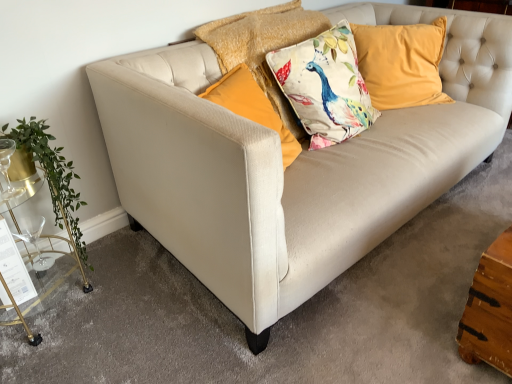
I want to click on green leafy plant at left, so click(53, 176).

Where is `velvet yellow pillow at upper right, acting as the first pillow starting from the right`? This screenshot has height=384, width=512. velvet yellow pillow at upper right, acting as the first pillow starting from the right is located at coordinates (401, 63).

You are a GUI agent. You are given a task and a screenshot of the screen. Output one action in this format:
    pyautogui.click(x=<x>, y=<y>)
    Task: Click on the gold metallic bar cart at left
    This screenshot has height=384, width=512.
    Given the screenshot: What is the action you would take?
    pyautogui.click(x=18, y=316)

Does green leafy plant at left turn towards gold metallic bar cart at left?

Yes, green leafy plant at left is oriented towards gold metallic bar cart at left.

Can you confirm if green leafy plant at left is positioned to the right of gold metallic bar cart at left?

Yes.

Is green leafy plant at left beside gold metallic bar cart at left?

No, green leafy plant at left is not with gold metallic bar cart at left.

Measure the distance between clear glass wine glass at lower left and velvet yellow pillow at upper right, the second pillow when ordered from left to right.

clear glass wine glass at lower left and velvet yellow pillow at upper right, the second pillow when ordered from left to right, are 6.13 feet apart.

How different are the orientations of clear glass wine glass at lower left and velvet yellow pillow at upper right, the second pillow when ordered from left to right, in degrees?

They differ by 39.6 degrees in their facing directions.

Is clear glass wine glass at lower left positioned behind velvet yellow pillow at upper right, the second pillow when ordered from left to right?

No, it is in front of velvet yellow pillow at upper right, the second pillow when ordered from left to right.

Is clear glass wine glass at lower left directly adjacent to velvet yellow pillow at upper right, the second pillow when ordered from left to right?

No, clear glass wine glass at lower left is not next to velvet yellow pillow at upper right, the second pillow when ordered from left to right.

Is the surface of green leafy plant at left in direct contact with velvet yellow pillow at upper right, acting as the first pillow starting from the right?

No, green leafy plant at left is not with velvet yellow pillow at upper right, acting as the first pillow starting from the right.

Considering the relative positions of green leafy plant at left and velvet yellow pillow at upper right, acting as the first pillow starting from the right, in the image provided, is green leafy plant at left to the left of velvet yellow pillow at upper right, acting as the first pillow starting from the right, from the viewer's perspective?

Yes, green leafy plant at left is to the left of velvet yellow pillow at upper right, acting as the first pillow starting from the right.

Does point (61, 199) come farther from viewer compared to point (385, 98)?

No, (61, 199) is closer to viewer.

From the image's perspective, which one is positioned lower, velvet yellow pillow at upper right, the second pillow when ordered from left to right, or gold metallic bar cart at left?

gold metallic bar cart at left is shown below in the image.

From a real-world perspective, relative to gold metallic bar cart at left, is velvet yellow pillow at upper right, acting as the first pillow starting from the right, vertically above or below?

Clearly, from a real-world perspective, velvet yellow pillow at upper right, acting as the first pillow starting from the right, is above gold metallic bar cart at left.

Is velvet yellow pillow at upper right, the second pillow when ordered from left to right, positioned with its back to gold metallic bar cart at left?

No, velvet yellow pillow at upper right, the second pillow when ordered from left to right,'s orientation is not away from gold metallic bar cart at left.

Which object is thinner, velvet yellow pillow at upper right, the second pillow when ordered from left to right, or gold metallic bar cart at left?

velvet yellow pillow at upper right, the second pillow when ordered from left to right.

Is green leafy plant at left not close to floral fabric cushion at center, arranged as the second pillow when viewed from the right?

No, green leafy plant at left is not far away from floral fabric cushion at center, arranged as the second pillow when viewed from the right.

Identify the location of plant below the floral fabric cushion at center, arranged as the second pillow when viewed from the right (from a real-world perspective). (53, 176).

Is green leafy plant at left shorter than floral fabric cushion at center, acting as the 1th pillow starting from the left?

No.

From the image's perspective, which one is positioned lower, green leafy plant at left or floral fabric cushion at center, acting as the 1th pillow starting from the left?

green leafy plant at left appears lower in the image.

In the scene shown: From the image's perspective, between gold metallic bar cart at left and velvet yellow pillow at upper right, acting as the first pillow starting from the right, who is located below?

gold metallic bar cart at left, from the image's perspective.

Which is behind, point (6, 180) or point (400, 56)?

The point (400, 56) is farther from the camera.

Considering the sizes of objects gold metallic bar cart at left and velvet yellow pillow at upper right, the second pillow when ordered from left to right, in the image provided, who is wider, gold metallic bar cart at left or velvet yellow pillow at upper right, the second pillow when ordered from left to right,?

gold metallic bar cart at left is wider.

From a real-world perspective, is gold metallic bar cart at left positioned above or below velvet yellow pillow at upper right, acting as the first pillow starting from the right?

gold metallic bar cart at left is below velvet yellow pillow at upper right, acting as the first pillow starting from the right.

Is point (267, 69) closer to viewer compared to point (24, 220)?

That is False.

Looking at this image, is clear glass wine glass at lower left inside floral fabric cushion at center, acting as the 1th pillow starting from the left?

Actually, clear glass wine glass at lower left is outside floral fabric cushion at center, acting as the 1th pillow starting from the left.

From a real-world perspective, relative to clear glass wine glass at lower left, is floral fabric cushion at center, arranged as the second pillow when viewed from the right, vertically above or below?

From a real-world perspective, floral fabric cushion at center, arranged as the second pillow when viewed from the right, is physically above clear glass wine glass at lower left.

What's the angular difference between floral fabric cushion at center, acting as the 1th pillow starting from the left, and clear glass wine glass at lower left's facing directions?

The angular difference between floral fabric cushion at center, acting as the 1th pillow starting from the left, and clear glass wine glass at lower left is 0.141 degrees.

In order to click on plant behind the gold metallic bar cart at left in this screenshot , I will do `click(53, 176)`.

From the image's perspective, count 2nd pillows upward from the clear glass wine glass at lower left and point to it. Please provide its 2D coordinates.

[(401, 63)]

Considering their positions, is clear glass wine glass at lower left positioned further to floral fabric cushion at center, acting as the 1th pillow starting from the left, than gold metallic bar cart at left?

Based on the image, clear glass wine glass at lower left appears to be further to floral fabric cushion at center, acting as the 1th pillow starting from the left.

Estimate the real-world distances between objects in this image. Which object is closer to velvet yellow pillow at upper right, acting as the first pillow starting from the right, floral fabric cushion at center, arranged as the second pillow when viewed from the right, or green leafy plant at left?

Based on the image, floral fabric cushion at center, arranged as the second pillow when viewed from the right, appears to be nearer to velvet yellow pillow at upper right, acting as the first pillow starting from the right.

Based on their spatial positions, is gold metallic bar cart at left or velvet yellow pillow at upper right, acting as the first pillow starting from the right, further from clear glass wine glass at lower left?

Based on the image, velvet yellow pillow at upper right, acting as the first pillow starting from the right, appears to be further to clear glass wine glass at lower left.

From the image, which object appears to be nearer to velvet yellow pillow at upper right, the second pillow when ordered from left to right, gold metallic bar cart at left or floral fabric cushion at center, acting as the 1th pillow starting from the left?

Based on the image, floral fabric cushion at center, acting as the 1th pillow starting from the left, appears to be nearer to velvet yellow pillow at upper right, the second pillow when ordered from left to right.

Which object lies nearer to the anchor point velvet yellow pillow at upper right, acting as the first pillow starting from the right, green leafy plant at left or gold metallic bar cart at left?

The object closer to velvet yellow pillow at upper right, acting as the first pillow starting from the right, is green leafy plant at left.

In the scene shown: From the image, which object appears to be nearer to velvet yellow pillow at upper right, the second pillow when ordered from left to right, green leafy plant at left or clear glass wine glass at lower left?

green leafy plant at left is closer to velvet yellow pillow at upper right, the second pillow when ordered from left to right.

From the image, which object appears to be nearer to gold metallic bar cart at left, green leafy plant at left or clear glass wine glass at lower left?

clear glass wine glass at lower left is positioned closer to the anchor gold metallic bar cart at left.

From the image, which object appears to be farther from floral fabric cushion at center, acting as the 1th pillow starting from the left, velvet yellow pillow at upper right, acting as the first pillow starting from the right, or green leafy plant at left?

The object further to floral fabric cushion at center, acting as the 1th pillow starting from the left, is green leafy plant at left.

Where is `pillow situated between green leafy plant at left and velvet yellow pillow at upper right, the second pillow when ordered from left to right, from left to right`? The width and height of the screenshot is (512, 384). pillow situated between green leafy plant at left and velvet yellow pillow at upper right, the second pillow when ordered from left to right, from left to right is located at coordinates (263, 46).

The height and width of the screenshot is (384, 512). I want to click on wine glass between gold metallic bar cart at left and floral fabric cushion at center, acting as the 1th pillow starting from the left, in the horizontal direction, so click(35, 241).

At what (x,y) coordinates should I click in order to perform the action: click on plant between clear glass wine glass at lower left and velvet yellow pillow at upper right, the second pillow when ordered from left to right, in the horizontal direction. Please return your answer as a coordinate pair (x, y). Image resolution: width=512 pixels, height=384 pixels. Looking at the image, I should click on (53, 176).

You are a GUI agent. You are given a task and a screenshot of the screen. Output one action in this format:
    pyautogui.click(x=<x>, y=<y>)
    Task: Click on the pillow situated between clear glass wine glass at lower left and velvet yellow pillow at upper right, acting as the first pillow starting from the right, from left to right
    
    Given the screenshot: What is the action you would take?
    pyautogui.click(x=263, y=46)